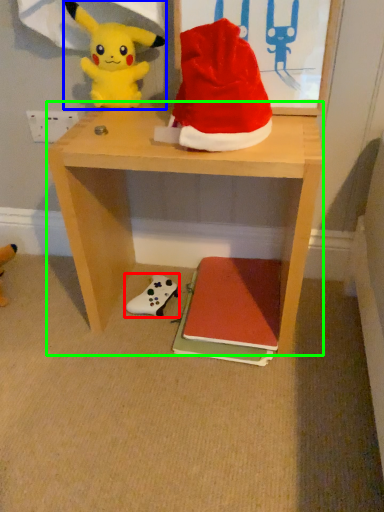
Question: Which object is positioned farthest from toy (highlighted by a red box)? Select from toy (highlighted by a blue box) and desk (highlighted by a green box).

Choices:
 (A) toy
 (B) desk

Answer: (A)